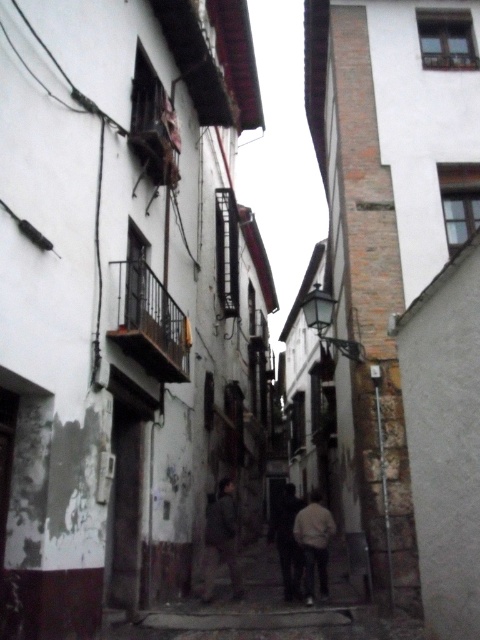
You are a photographer aiming to capture both the dark gray fabric couple at center and the dark gray fabric pants at center in a single frame. Based on their positions, which object should you adjust your camera to focus on first to ensure both are in the shot?

The dark gray fabric couple at center is to the left of dark gray fabric pants at center, so you should focus on the dark gray fabric couple at center first to ensure both are captured in the frame.

You are a tailor standing in the alleyway between the two buildings. You see a light beige fabric jacket at center and a dark gray fabric pants at center. Which item of clothing is larger in size?

The dark gray fabric pants at center are larger than the light beige fabric jacket at center.

You are standing at the entrance of the alleyway and want to walk towards the end. There are two points marked in the alleyway, point A at coordinates point (312,524) and point B at coordinates point (288,554). Which point will you reach first as you walk forward?

Point A at coordinates point (312,524) will be reached first because it is positioned in front of point B at coordinates point (288,554) along the alleyway.